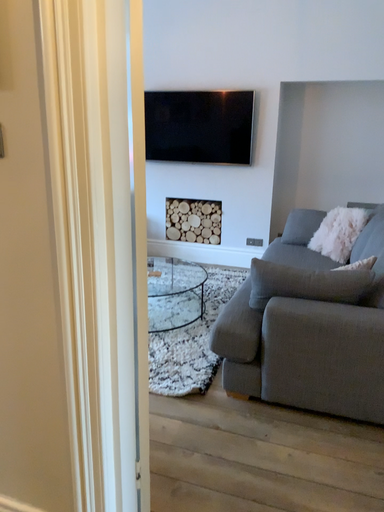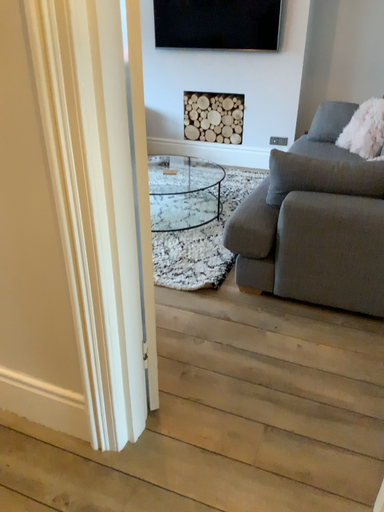
Question: How did the camera likely rotate when shooting the video?

Choices:
 (A) rotated upward
 (B) rotated downward

Answer: (B)